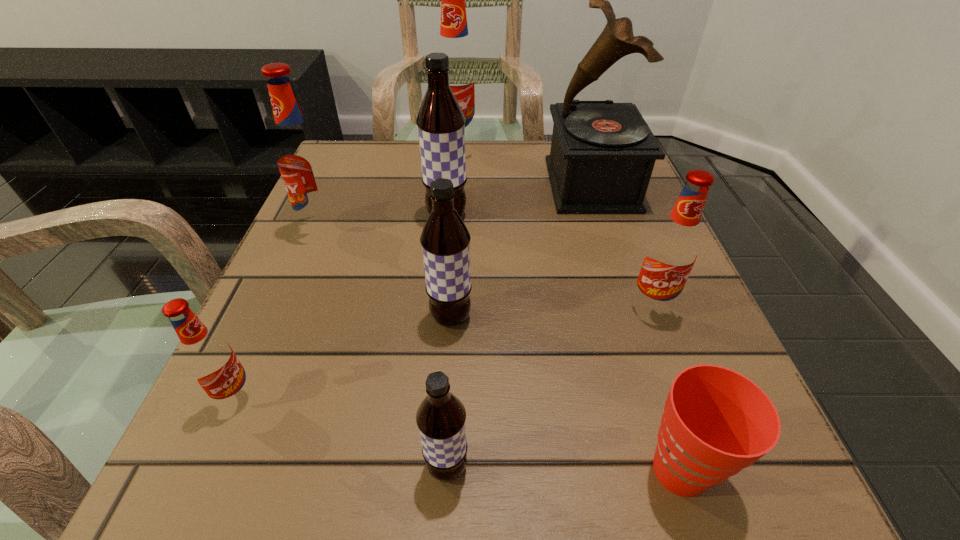
Choose which red root beer is the third nearest neighbor to the biggest red root beer. Please provide its 2D coordinates. Your answer should be formatted as a tuple, i.e. [(x, y)], where the tuple contains the x and y coordinates of a point satisfying the conditions above.

[(209, 358)]

At what (x,y) coordinates should I click in order to perform the action: click on red root beer that stands as the closest to the second nearest brown root beer. Please return your answer as a coordinate pair (x, y). This screenshot has height=540, width=960. Looking at the image, I should click on (302, 160).

Select which brown root beer appears as the second closest to the rightmost root beer. Please provide its 2D coordinates. Your answer should be formatted as a tuple, i.e. [(x, y)], where the tuple contains the x and y coordinates of a point satisfying the conditions above.

[(441, 123)]

Identify the location of brown root beer that stands as the closest to the phonograph_record. (441, 123).

This screenshot has height=540, width=960. I want to click on free space that satisfies the following two spatial constraints: 1. on the back side of the tallest root beer; 2. on the right side of the second biggest red root beer, so click(355, 152).

This screenshot has width=960, height=540. What are the coordinates of `free region that satisfies the following two spatial constraints: 1. on the back side of the second farthest brown root beer; 2. on the left side of the rightmost red root beer` in the screenshot? It's located at click(x=451, y=307).